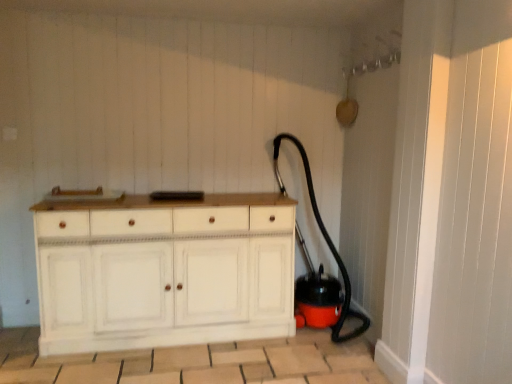
The width and height of the screenshot is (512, 384). I want to click on vacant space in between white wood chest of drawers at center and black rubber garden hose at lower right, so click(214, 354).